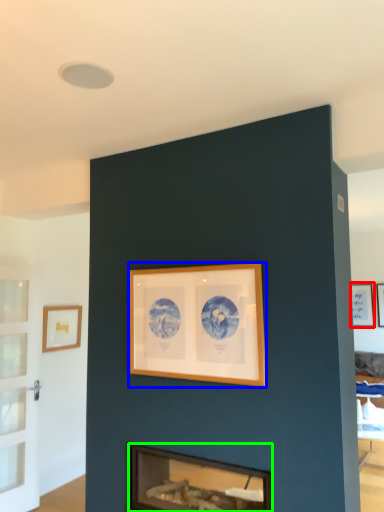
Question: Which object is positioned farthest from picture frame (highlighted by a red box)? Select from picture frame (highlighted by a blue box) and fireplace (highlighted by a green box).

Choices:
 (A) picture frame
 (B) fireplace

Answer: (B)